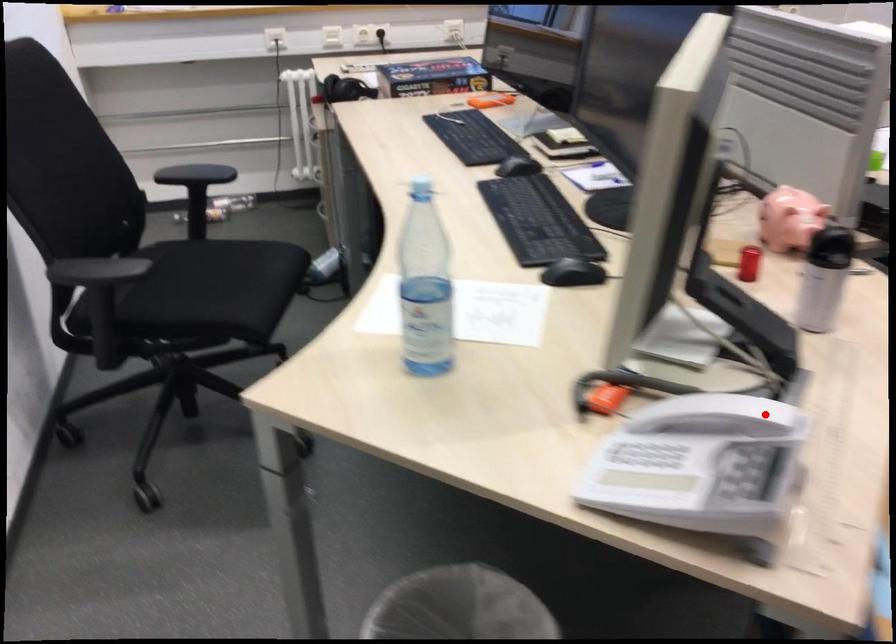
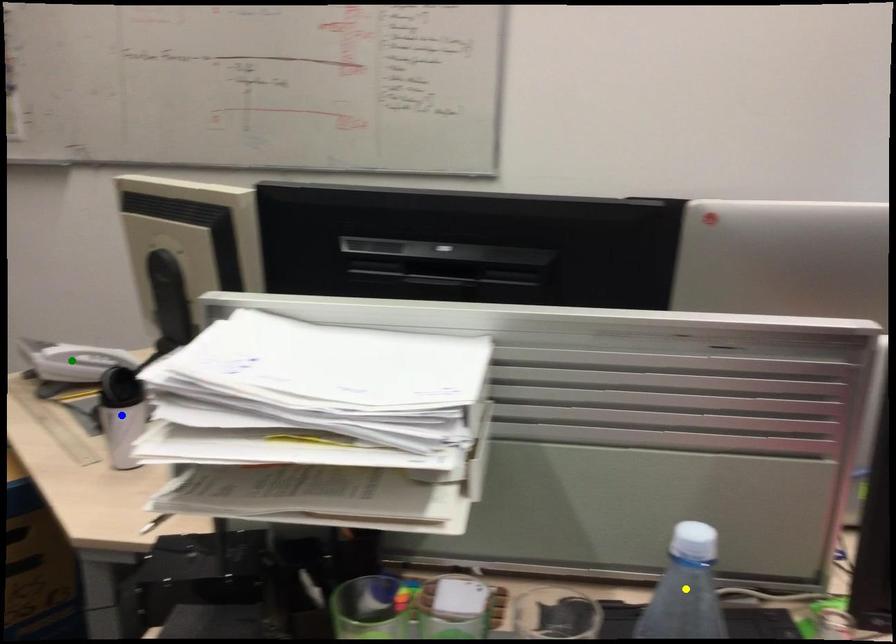
Question: I am providing you with two images of the same scene from different viewpoints. A red point is marked on the first image. You are given multiple points on the second image. In image 2, which mark is for the same physical point as the one in image 1?

Choices:
 (A) yellow point
 (B) blue point
 (C) green point

Answer: (C)